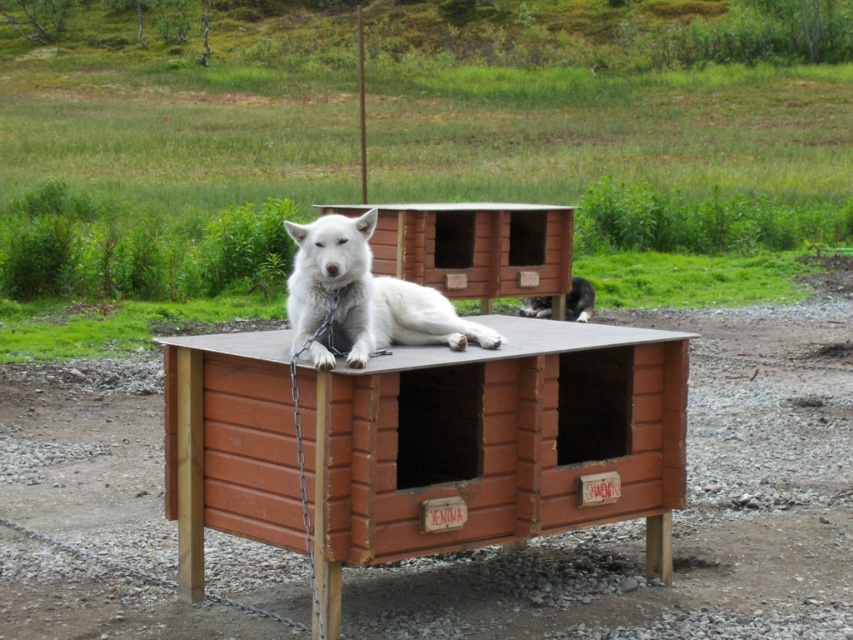
Question: Estimate the real-world distances between objects in this image. Which object is closer to the white fur dog at center?

Choices:
 (A) black fur cat at center
 (B) brown wooden table at center

Answer: (B)

Question: Is brown wooden table at center behind white fur dog at center?

Choices:
 (A) no
 (B) yes

Answer: (A)

Question: Can you confirm if brown wooden table at center is smaller than white fur dog at center?

Choices:
 (A) no
 (B) yes

Answer: (A)

Question: Which object is the farthest from the brown wooden table at center?

Choices:
 (A) black fur cat at center
 (B) white fur dog at center

Answer: (A)

Question: Which point is closer to the camera?

Choices:
 (A) (531, 312)
 (B) (201, 499)

Answer: (B)

Question: Where is brown wooden table at center located in relation to black fur cat at center in the image?

Choices:
 (A) left
 (B) right

Answer: (A)